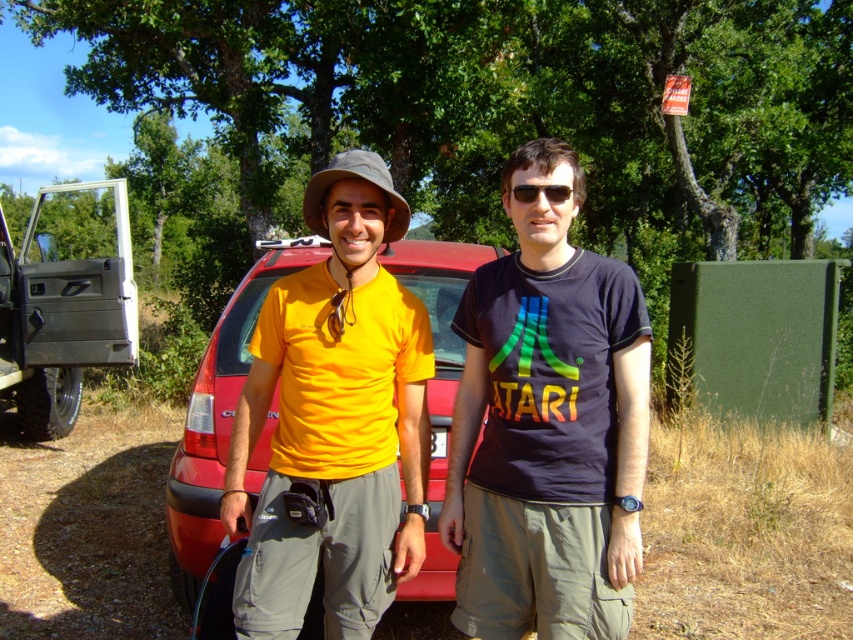
Does dark blue t-shirt at center appear under metallic gray pickup truck at left?

Correct, dark blue t-shirt at center is located below metallic gray pickup truck at left.

Can you confirm if dark blue t-shirt at center is smaller than metallic gray pickup truck at left?

Correct, dark blue t-shirt at center occupies less space than metallic gray pickup truck at left.

This screenshot has height=640, width=853. I want to click on dark blue t-shirt at center, so click(x=548, y=426).

Which is more to the left, dark blue t-shirt at center or black plastic sunglasses at center?

black plastic sunglasses at center

Between point (575, 534) and point (561, 188), which one is positioned in front?

Positioned in front is point (575, 534).

Identify the location of dark blue t-shirt at center. The image size is (853, 640). (548, 426).

Describe the element at coordinates (65, 301) in the screenshot. I see `metallic gray pickup truck at left` at that location.

Does metallic gray pickup truck at left have a greater width compared to black plastic sunglasses at center?

Yes, metallic gray pickup truck at left is wider than black plastic sunglasses at center.

Locate an element on the screen. This screenshot has height=640, width=853. metallic gray pickup truck at left is located at coordinates (65, 301).